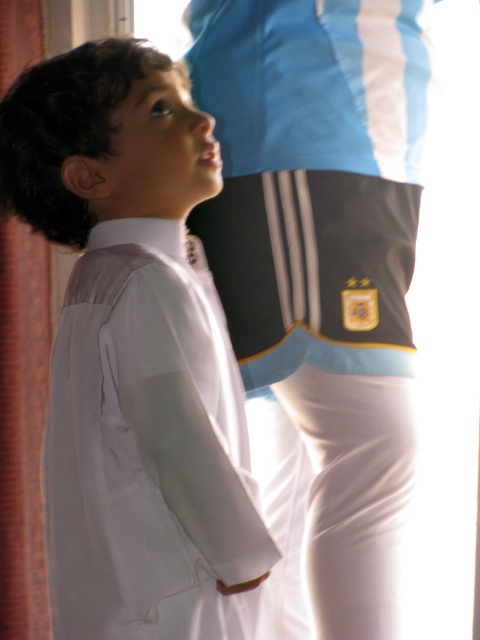
You are a photographer trying to capture a clear shot of the white smooth shirt at center and the brown fabric curtain at left. Since you want both objects in focus, you need to know which one is closer to you. Based on the scene description, which object is nearer?

The white smooth shirt at center is bigger than the brown fabric curtain at left, so it is closer to you.